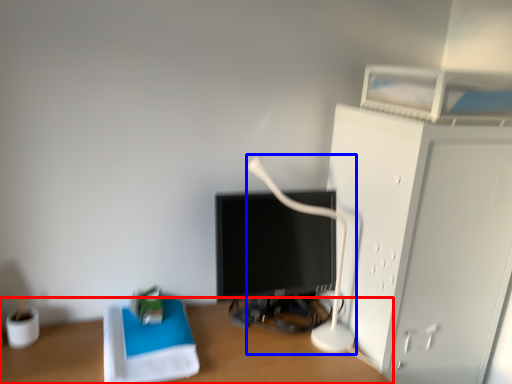
Question: Which point is further to the camera, desk (highlighted by a red box) or table lamp (highlighted by a blue box)?

Choices:
 (A) desk
 (B) table lamp

Answer: (B)